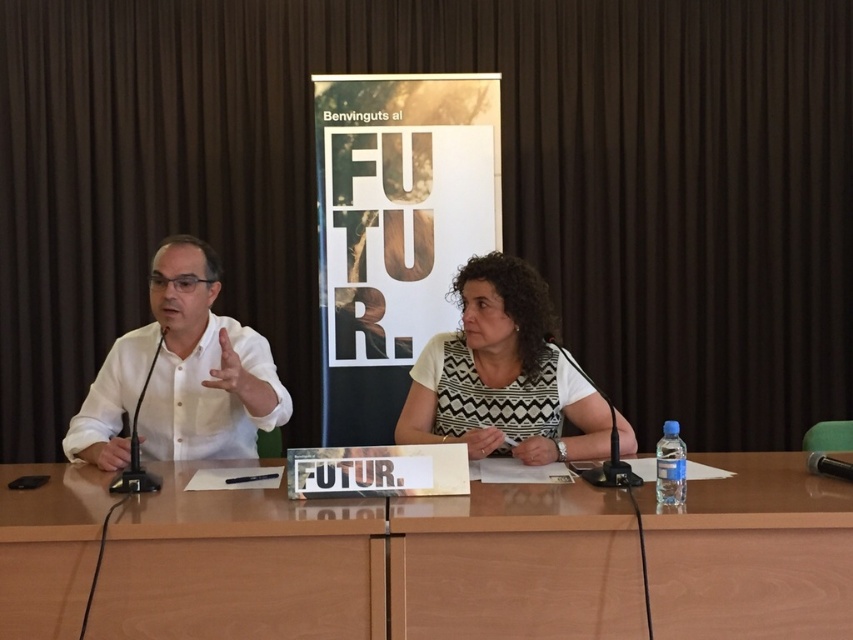
Which of these two, wooden table at center or white dotted dress at center, stands shorter?

With less height is wooden table at center.

Between point (186, 522) and point (432, 362), which one is positioned in front?

Point (186, 522) is in front.

Where is `wooden table at center`? The height and width of the screenshot is (640, 853). wooden table at center is located at coordinates (372, 564).

Can you confirm if white shirt at left is thinner than white dotted dress at center?

Indeed, white shirt at left has a lesser width compared to white dotted dress at center.

Who is positioned more to the right, white shirt at left or white dotted dress at center?

Positioned to the right is white dotted dress at center.

Identify the location of white shirt at left. The width and height of the screenshot is (853, 640). (181, 374).

Does wooden table at center have a smaller size compared to white shirt at left?

Incorrect, wooden table at center is not smaller in size than white shirt at left.

Can you confirm if wooden table at center is positioned to the right of white shirt at left?

Yes, wooden table at center is to the right of white shirt at left.

Between point (502, 496) and point (177, 381), which one is positioned behind?

Point (177, 381)

You are a GUI agent. You are given a task and a screenshot of the screen. Output one action in this format:
    pyautogui.click(x=<x>, y=<y>)
    Task: Click on the wooden table at center
    Image resolution: width=853 pixels, height=640 pixels.
    Given the screenshot: What is the action you would take?
    pyautogui.click(x=372, y=564)